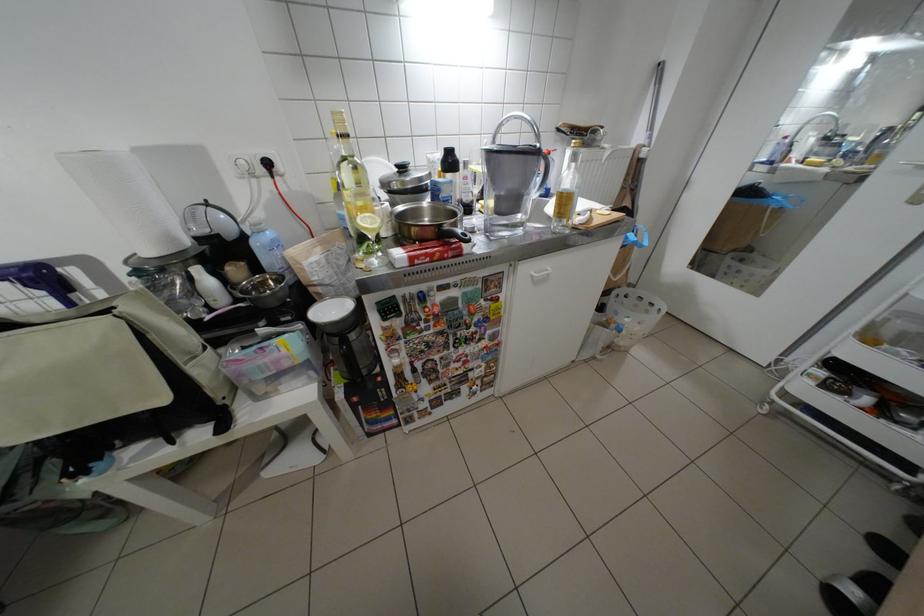
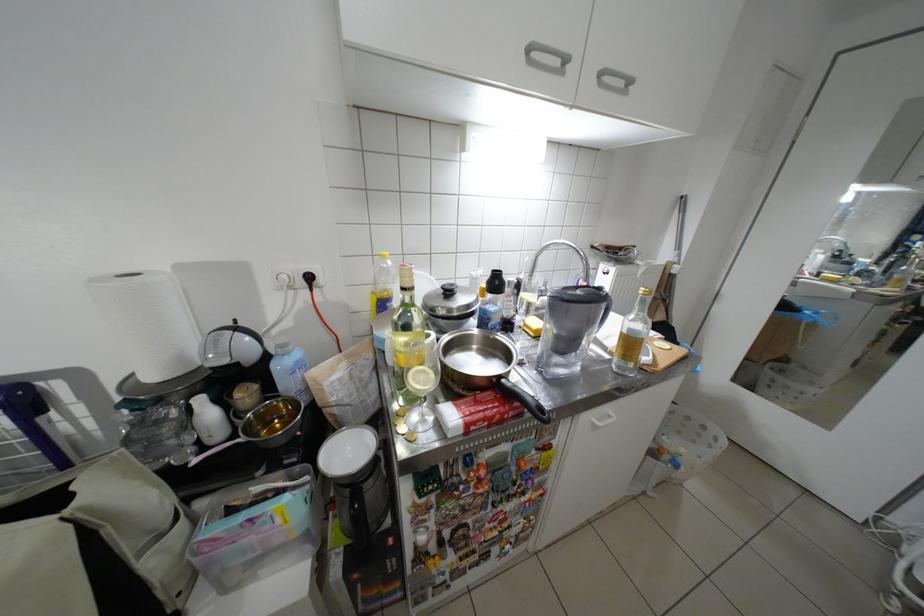
Which direction would the cameraman need to move to produce the second image?

The cameraman moved toward left, forward.